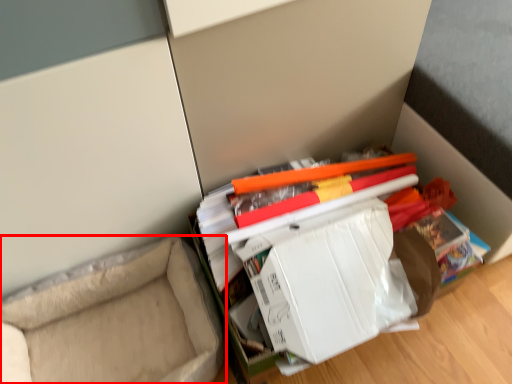
Question: Considering the relative positions of furniture (annotated by the red box) and paperback book in the image provided, where is furniture (annotated by the red box) located with respect to the staircase?

Choices:
 (A) right
 (B) left

Answer: (B)